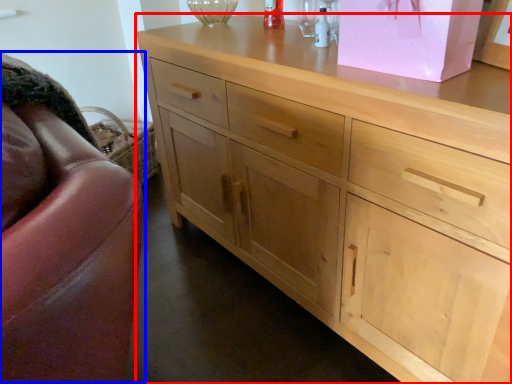
Question: Among these objects, which one is farthest to the camera, chest of drawers (highlighted by a red box) or swivel chair (highlighted by a blue box)?

Choices:
 (A) chest of drawers
 (B) swivel chair

Answer: (B)